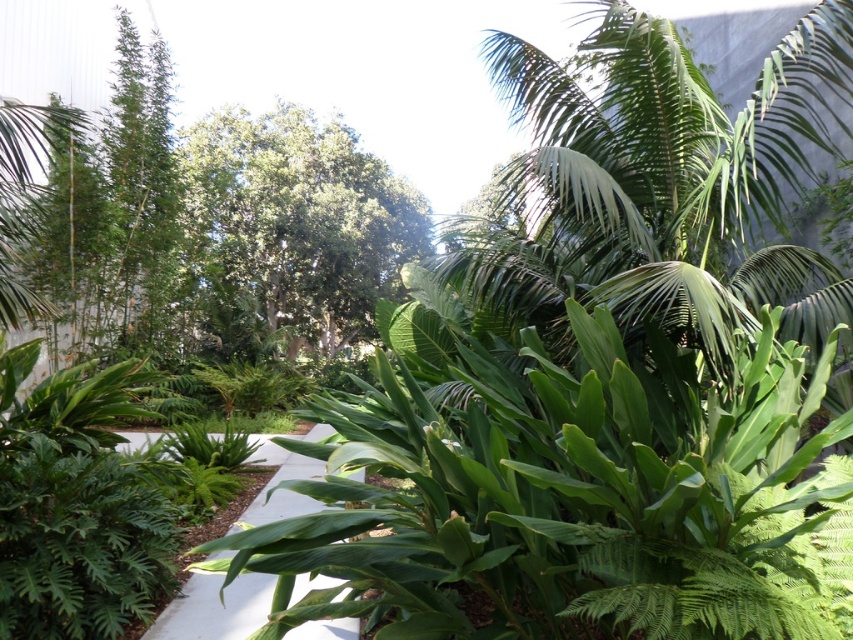
Question: Does green leafy tree at center come behind white concrete path at center?

Choices:
 (A) no
 (B) yes

Answer: (B)

Question: Which of the following is the closest to the observer?

Choices:
 (A) white concrete path at center
 (B) green leafy tree at center

Answer: (A)

Question: Which point is farther to the camera?

Choices:
 (A) white concrete path at center
 (B) green leafy tree at center

Answer: (B)

Question: Is green leafy tree at center below white concrete path at center?

Choices:
 (A) yes
 (B) no

Answer: (B)

Question: Does green leafy tree at center come in front of white concrete path at center?

Choices:
 (A) yes
 (B) no

Answer: (B)

Question: Which point is farther from the camera taking this photo?

Choices:
 (A) (183, 172)
 (B) (309, 440)

Answer: (A)